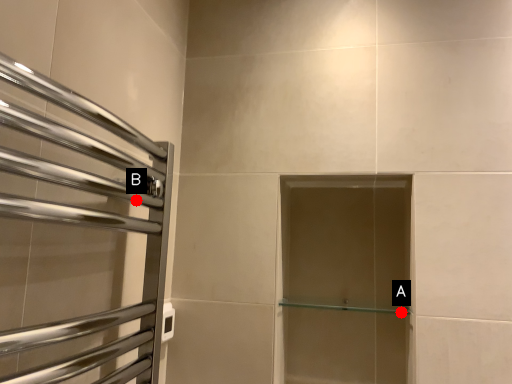
Question: Two points are circled on the image, labeled by A and B beside each circle. Which of the following is the closest to the observer?

Choices:
 (A) A is closer
 (B) B is closer

Answer: (B)